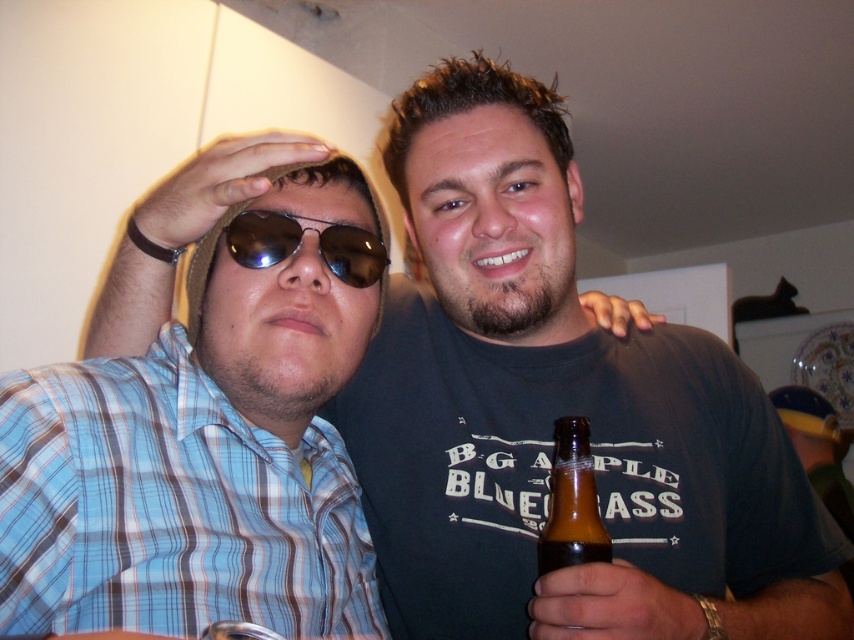
Between point (581, 432) and point (344, 234), which one is positioned behind?

Positioned behind is point (344, 234).

Can you confirm if brown glass bottle at lower right is positioned below sunglasses at center?

Correct, brown glass bottle at lower right is located below sunglasses at center.

Identify the location of brown glass bottle at lower right. (572, 502).